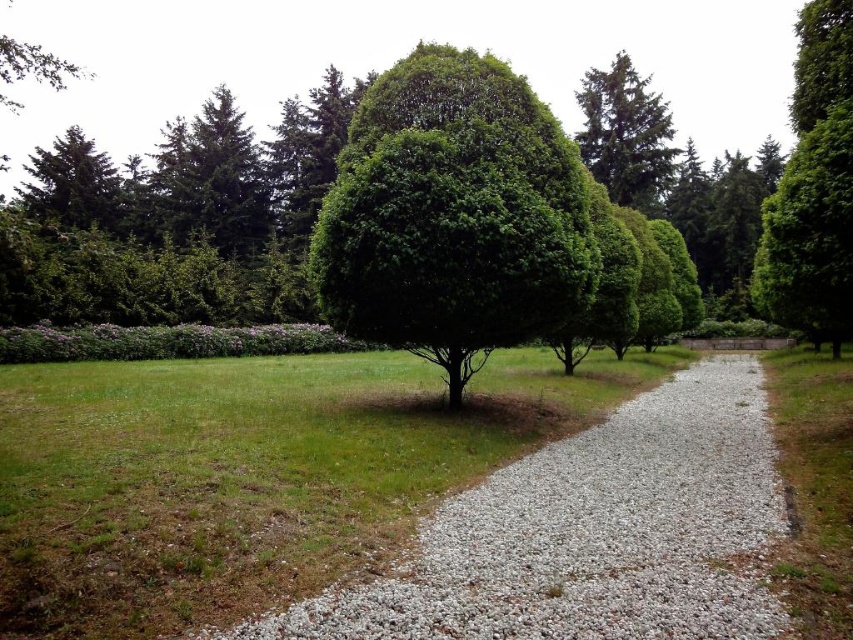
Is point (724, 620) positioned before point (650, 150)?

That is True.

The width and height of the screenshot is (853, 640). Find the location of `white gravel at center`. white gravel at center is located at coordinates (589, 534).

Can you confirm if green leafy tree at right is thinner than green textured tree at upper right?

Indeed, green leafy tree at right has a lesser width compared to green textured tree at upper right.

This screenshot has width=853, height=640. I want to click on green leafy tree at right, so [810, 234].

How far apart are white gravel at center and green leafy tree at center?

white gravel at center and green leafy tree at center are 3.66 meters apart from each other.

Is white gravel at center positioned in front of green leafy tree at center?

Yes, it is in front of green leafy tree at center.

Between point (660, 532) and point (538, 172), which one is positioned in front?

Point (660, 532) is more forward.

The image size is (853, 640). Identify the location of white gravel at center. [x=589, y=534].